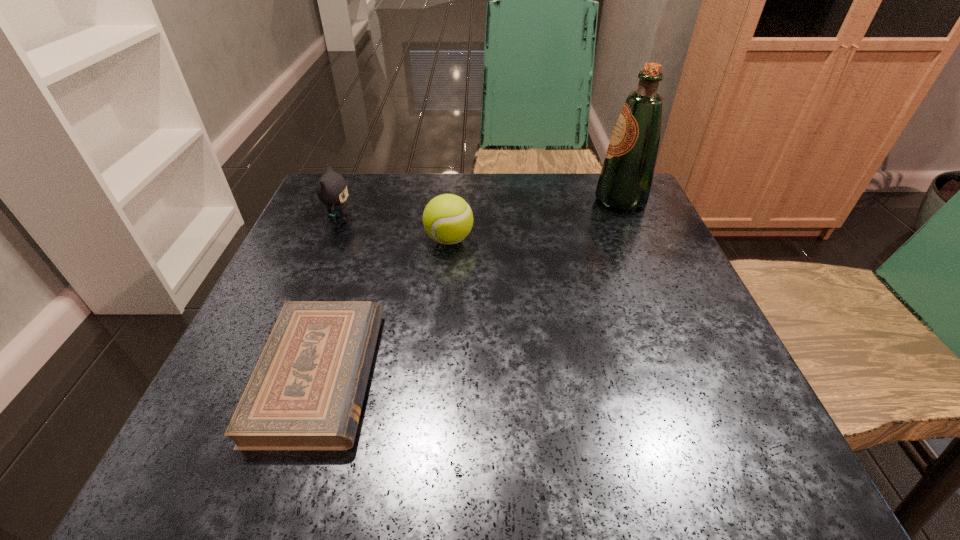
Locate an element on the screen. The image size is (960, 540). vacant space in between the kitten and the rightmost object is located at coordinates (480, 209).

Locate an element on the screen. vacant point located between the nearest object and the olive oil is located at coordinates (470, 287).

The width and height of the screenshot is (960, 540). I want to click on unoccupied area between the kitten and the nearest object, so click(329, 296).

In order to click on free space between the third object from left to right and the shortest object in this screenshot , I will do `click(384, 307)`.

Identify the location of vacant space that is in between the Bible and the rightmost object. 470,287.

Locate an element on the screen. blank region between the shortest object and the kitten is located at coordinates (329, 296).

Where is `free spot between the shortest object and the olive oil`? free spot between the shortest object and the olive oil is located at coordinates point(470,287).

Identify the location of free space that is in between the tallest object and the kitten. (480, 209).

Identify the location of unoccupied area between the kitten and the nearest object. (329, 296).

Identify which object is the second closest to the tennis ball. Please provide its 2D coordinates. Your answer should be formatted as a tuple, i.e. [(x, y)], where the tuple contains the x and y coordinates of a point satisfying the conditions above.

[(306, 392)]